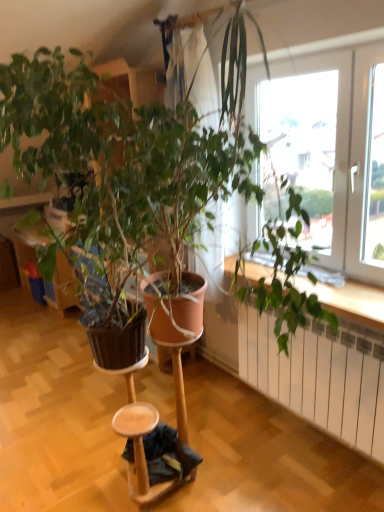
The height and width of the screenshot is (512, 384). Describe the element at coordinates (153, 453) in the screenshot. I see `wooden step stool at lower center` at that location.

Where is `wooden step stool at lower center`? The height and width of the screenshot is (512, 384). wooden step stool at lower center is located at coordinates (153, 453).

Describe the element at coordinates (320, 375) in the screenshot. I see `white metallic radiator at lower right` at that location.

At what (x,y) coordinates should I click in order to perform the action: click on white metallic radiator at lower right. Please return your answer as a coordinate pair (x, y). This screenshot has height=512, width=384. Looking at the image, I should click on (320, 375).

At what (x,y) coordinates should I click in order to perform the action: click on wooden step stool at lower center. Please return your answer as a coordinate pair (x, y). Looking at the image, I should click on (153, 453).

Considering the relative positions of wooden step stool at lower center and white metallic radiator at lower right in the image provided, is wooden step stool at lower center to the right of white metallic radiator at lower right from the viewer's perspective?

Incorrect, wooden step stool at lower center is not on the right side of white metallic radiator at lower right.

Between wooden step stool at lower center and white metallic radiator at lower right, which one is positioned in front?

white metallic radiator at lower right is closer to the camera.

Is point (139, 436) positioned in front of point (355, 378)?

Yes, it is.

From the image's perspective, does wooden step stool at lower center appear lower than white metallic radiator at lower right?

Indeed, from the image's perspective, wooden step stool at lower center is shown beneath white metallic radiator at lower right.

Based on the photo, from a real-world perspective, is wooden step stool at lower center physically located above or below white metallic radiator at lower right?

wooden step stool at lower center is below white metallic radiator at lower right.

Which of these two, wooden step stool at lower center or white metallic radiator at lower right, is thinner?

white metallic radiator at lower right.

Considering the sizes of objects wooden step stool at lower center and white metallic radiator at lower right in the image provided, who is shorter, wooden step stool at lower center or white metallic radiator at lower right?

wooden step stool at lower center is shorter.

Is wooden step stool at lower center bigger than white metallic radiator at lower right?

No.

From the picture: Is white metallic radiator at lower right a part of wooden step stool at lower center?

No, white metallic radiator at lower right is not inside wooden step stool at lower center.

Would you say wooden step stool at lower center is a long distance from white metallic radiator at lower right?

No, there isn't a large distance between wooden step stool at lower center and white metallic radiator at lower right.

Is wooden step stool at lower center aimed at white metallic radiator at lower right?

No, wooden step stool at lower center is not oriented towards white metallic radiator at lower right.

How different are the orientations of wooden step stool at lower center and white metallic radiator at lower right in degrees?

They differ by 1.2 degrees in their facing directions.

This screenshot has width=384, height=512. I want to click on radiator in front of the wooden step stool at lower center, so click(x=320, y=375).

Considering the positions of objects white metallic radiator at lower right and wooden step stool at lower center in the image provided, who is more to the right, white metallic radiator at lower right or wooden step stool at lower center?

white metallic radiator at lower right is more to the right.

Relative to wooden step stool at lower center, is white metallic radiator at lower right in front or behind?

white metallic radiator at lower right is positioned closer to the viewer than wooden step stool at lower center.

Which is in front, point (342, 416) or point (146, 500)?

The point (146, 500) is more forward.

From the image's perspective, between white metallic radiator at lower right and wooden step stool at lower center, who is located below?

From the image's view, wooden step stool at lower center is below.

From a real-world perspective, does white metallic radiator at lower right stand above wooden step stool at lower center?

Yes, from a real-world perspective, white metallic radiator at lower right is above wooden step stool at lower center.

In terms of width, does white metallic radiator at lower right look wider or thinner when compared to wooden step stool at lower center?

Clearly, white metallic radiator at lower right has less width compared to wooden step stool at lower center.

Between white metallic radiator at lower right and wooden step stool at lower center, which one has less height?

Standing shorter between the two is wooden step stool at lower center.

In terms of size, does white metallic radiator at lower right appear bigger or smaller than wooden step stool at lower center?

In the image, white metallic radiator at lower right appears to be larger than wooden step stool at lower center.

Is wooden step stool at lower center inside white metallic radiator at lower right?

No, wooden step stool at lower center is not a part of white metallic radiator at lower right.

Is white metallic radiator at lower right positioned far away from wooden step stool at lower center?

No.

Could you tell me if white metallic radiator at lower right is facing wooden step stool at lower center?

Yes.

The height and width of the screenshot is (512, 384). I want to click on step stool that appears on the left of white metallic radiator at lower right, so tap(153, 453).

At what (x,y) coordinates should I click in order to perform the action: click on step stool on the left side of white metallic radiator at lower right. Please return your answer as a coordinate pair (x, y). This screenshot has height=512, width=384. Looking at the image, I should click on (153, 453).

Locate an element on the screen. Image resolution: width=384 pixels, height=512 pixels. step stool that appears behind the white metallic radiator at lower right is located at coordinates (153, 453).